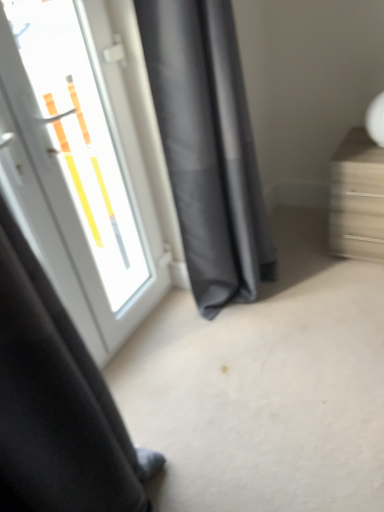
At what (x,y) coordinates should I click in order to perform the action: click on vacant space to the right of dark gray fabric curtain at center. Please return your answer as a coordinate pair (x, y). This screenshot has height=512, width=384. Looking at the image, I should click on (315, 271).